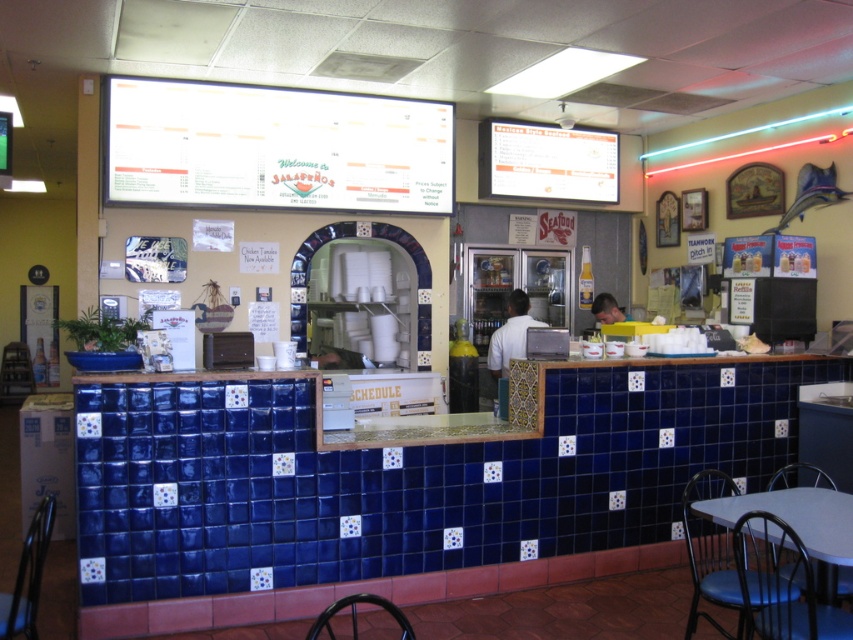
Which is more to the left, blue tile counter at center or black plastic chair at lower center?

Positioned to the left is black plastic chair at lower center.

Which of these two, blue tile counter at center or black plastic chair at lower center, stands shorter?

Standing shorter between the two is black plastic chair at lower center.

This screenshot has width=853, height=640. Describe the element at coordinates (409, 486) in the screenshot. I see `blue tile counter at center` at that location.

Image resolution: width=853 pixels, height=640 pixels. I want to click on blue tile counter at center, so click(x=409, y=486).

Who is lower down, blue tile counter at center or metallic black chair at lower left?

Positioned lower is metallic black chair at lower left.

Who is more forward, [303,564] or [47,529]?

Point [47,529]

The height and width of the screenshot is (640, 853). I want to click on blue tile counter at center, so click(409, 486).

Looking at this image, can you confirm if blue tile counter at center is bigger than metallic gray table at lower right?

Indeed, blue tile counter at center has a larger size compared to metallic gray table at lower right.

Can you confirm if blue tile counter at center is wider than metallic gray table at lower right?

Indeed, blue tile counter at center has a greater width compared to metallic gray table at lower right.

Is point (312, 566) closer to viewer compared to point (773, 512)?

No.

At what (x,y) coordinates should I click in order to perform the action: click on blue tile counter at center. Please return your answer as a coordinate pair (x, y). Image resolution: width=853 pixels, height=640 pixels. Looking at the image, I should click on (409, 486).